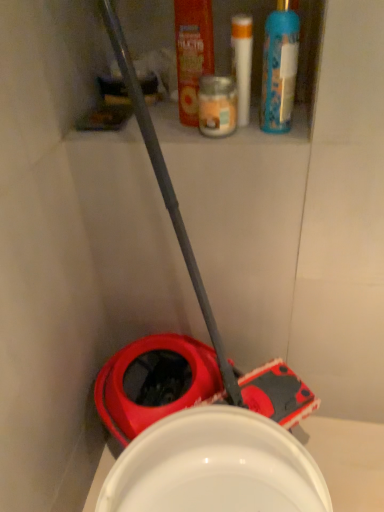
Question: Is the depth of white plastic tube at upper center, which is counted as the second toiletry, starting from the left, less than that of translucent glass candle at upper center, the 1th toiletry when ordered from left to right?

Choices:
 (A) no
 (B) yes

Answer: (A)

Question: From the image's perspective, is white plastic tube at upper center, the 1th toiletry in the right-to-left sequence, above translucent glass candle at upper center, the 1th toiletry when ordered from left to right?

Choices:
 (A) no
 (B) yes

Answer: (B)

Question: From the image's perspective, is white plastic tube at upper center, which is counted as the second toiletry, starting from the left, located beneath translucent glass candle at upper center, arranged as the second toiletry when viewed from the right?

Choices:
 (A) yes
 (B) no

Answer: (B)

Question: Is white plastic tube at upper center, the 1th toiletry in the right-to-left sequence, looking in the opposite direction of translucent glass candle at upper center, arranged as the second toiletry when viewed from the right?

Choices:
 (A) yes
 (B) no

Answer: (B)

Question: Does white plastic tube at upper center, which is counted as the second toiletry, starting from the left, turn towards translucent glass candle at upper center, the 1th toiletry when ordered from left to right?

Choices:
 (A) no
 (B) yes

Answer: (A)

Question: Is white plastic tube at upper center, the 1th toiletry in the right-to-left sequence, inside or outside of orange plastic mouthwash at upper center?

Choices:
 (A) outside
 (B) inside

Answer: (A)

Question: Considering the relative positions of white plastic tube at upper center, which is counted as the second toiletry, starting from the left, and orange plastic mouthwash at upper center in the image provided, is white plastic tube at upper center, which is counted as the second toiletry, starting from the left, to the left or to the right of orange plastic mouthwash at upper center?

Choices:
 (A) left
 (B) right

Answer: (B)

Question: From their relative heights in the image, would you say white plastic tube at upper center, the 1th toiletry in the right-to-left sequence, is taller or shorter than orange plastic mouthwash at upper center?

Choices:
 (A) short
 (B) tall

Answer: (A)

Question: Is point (238, 29) positioned closer to the camera than point (200, 6)?

Choices:
 (A) closer
 (B) farther

Answer: (B)

Question: Is blue plastic spray bottle at upper right wider or thinner than white plastic tube at upper center, the 1th toiletry in the right-to-left sequence?

Choices:
 (A) thin
 (B) wide

Answer: (A)

Question: Is blue plastic spray bottle at upper right spatially inside white plastic tube at upper center, the 1th toiletry in the right-to-left sequence, or outside of it?

Choices:
 (A) inside
 (B) outside

Answer: (B)

Question: From the image's perspective, is blue plastic spray bottle at upper right located above or below white plastic tube at upper center, which is counted as the second toiletry, starting from the left?

Choices:
 (A) below
 (B) above

Answer: (A)

Question: Relative to white plastic tube at upper center, the 1th toiletry in the right-to-left sequence, is blue plastic spray bottle at upper right in front or behind?

Choices:
 (A) front
 (B) behind

Answer: (A)

Question: Based on their positions, is blue plastic spray bottle at upper right located to the left or right of translucent glass candle at upper center, arranged as the second toiletry when viewed from the right?

Choices:
 (A) right
 (B) left

Answer: (A)

Question: Is point (281, 73) closer or farther from the camera than point (210, 82)?

Choices:
 (A) farther
 (B) closer

Answer: (B)